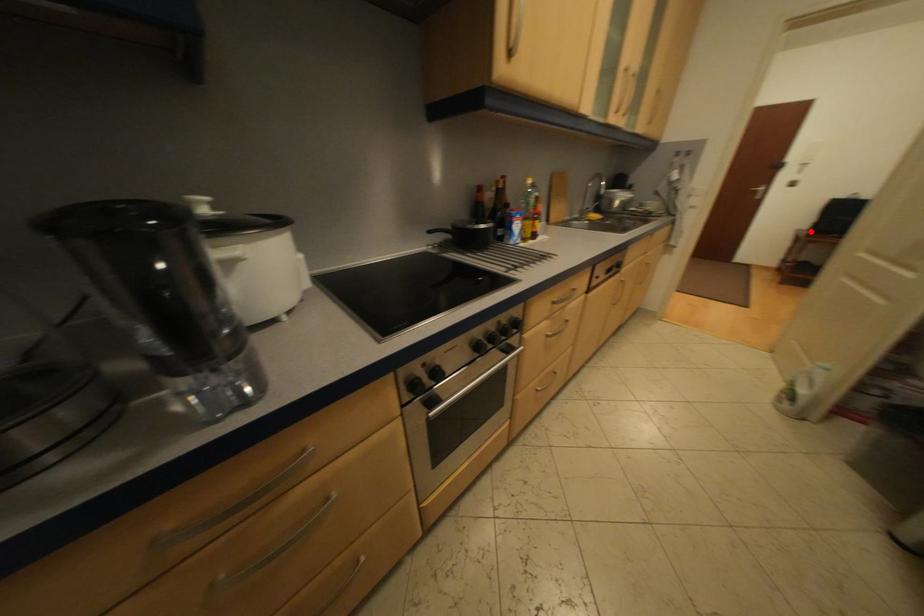
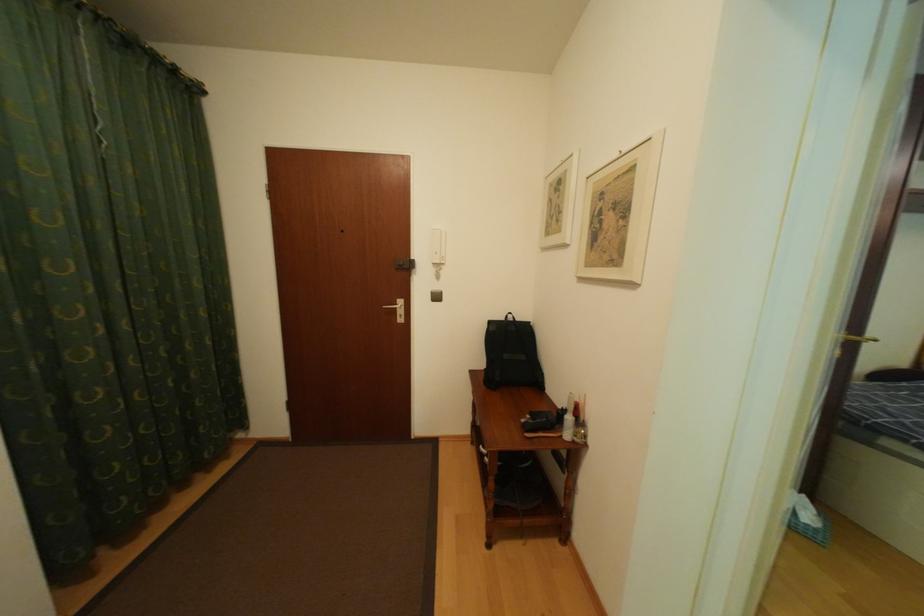
Find the pixel in the second image that matches the highlighted location in the first image.

(484, 374)